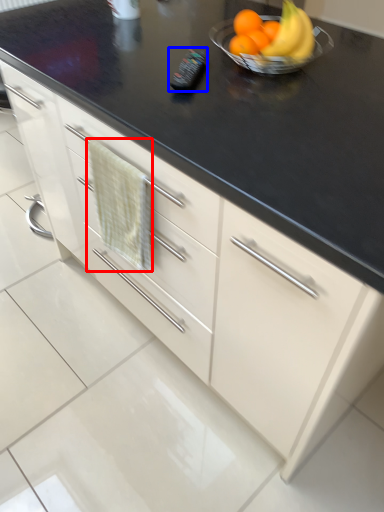
Question: Which point is further to the camera, hand towel (highlighted by a red box) or appliance (highlighted by a blue box)?

Choices:
 (A) hand towel
 (B) appliance

Answer: (B)